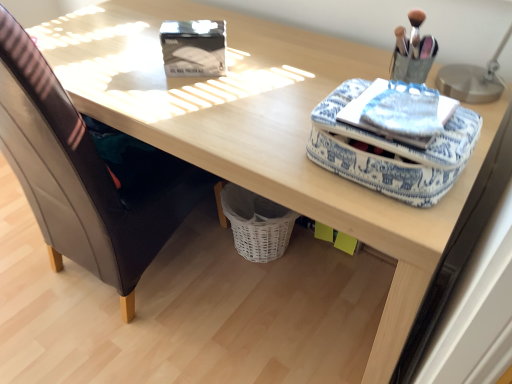
In order to click on vacant space that's between blue fabric case at upper right and matte black storage box at upper center in this screenshot , I will do `click(249, 101)`.